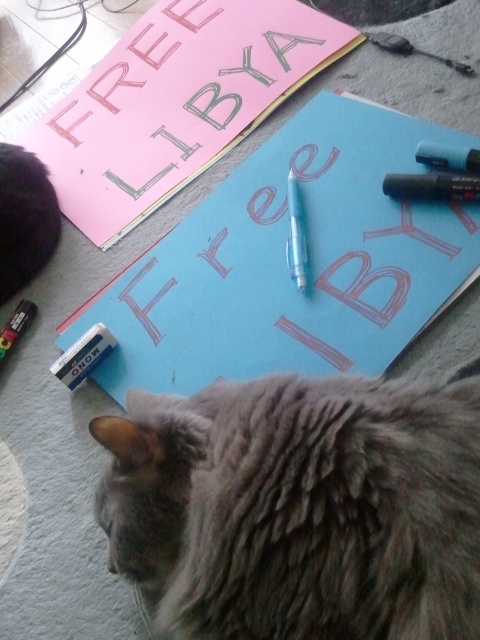
Does gray fluffy cat at lower center appear on the left side of gray fluffy cat at upper left?

No, gray fluffy cat at lower center is not to the left of gray fluffy cat at upper left.

Where is `gray fluffy cat at lower center`? Image resolution: width=480 pixels, height=640 pixels. gray fluffy cat at lower center is located at coordinates (299, 508).

Is point (333, 502) less distant than point (6, 266)?

Yes, it is.

Where is `gray fluffy cat at lower center`? Image resolution: width=480 pixels, height=640 pixels. gray fluffy cat at lower center is located at coordinates (299, 508).

Measure the distance between gray fluffy cat at upper left and camera.

The distance of gray fluffy cat at upper left from camera is 3.75 feet.

Who is more forward, (0, 284) or (288, 262)?

Point (288, 262) is more forward.

Image resolution: width=480 pixels, height=640 pixels. Identify the location of gray fluffy cat at upper left. (24, 218).

From the picture: Can you confirm if gray fluffy cat at lower center is taller than translucent plastic pencil at center?

Indeed, gray fluffy cat at lower center has a greater height compared to translucent plastic pencil at center.

You are a GUI agent. You are given a task and a screenshot of the screen. Output one action in this format:
    pyautogui.click(x=<x>, y=<y>)
    Task: Click on the gray fluffy cat at lower center
    Image resolution: width=480 pixels, height=640 pixels.
    Given the screenshot: What is the action you would take?
    pyautogui.click(x=299, y=508)

This screenshot has height=640, width=480. I want to click on gray fluffy cat at lower center, so click(299, 508).